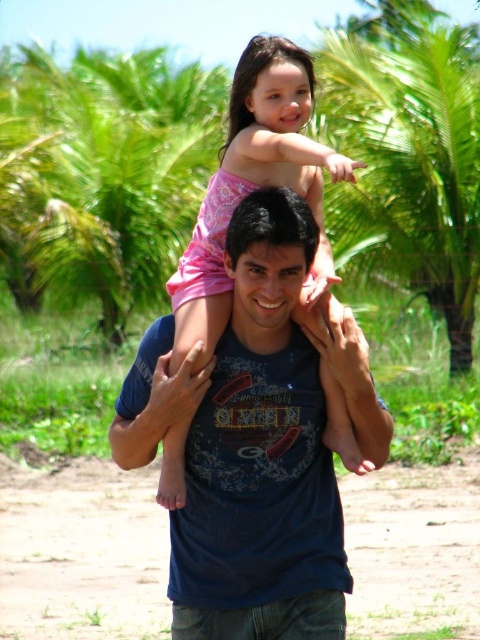
You are standing in the tropical location shown in the image. You want to take a photo of the palm tree represented by point (410, 152). Which direction should you face to capture it in your camera?

The green leafy palm tree at upper center is represented by point (410, 152). To capture it in your camera, you should face the upper center direction where the palm tree is located.

You are a photographer trying to capture a photo of the pink cotton shirt at center while also including the green leafy palm tree at upper center in the frame. Based on their sizes, will the palm tree appear larger than the shirt in the photo?

The green leafy palm tree at upper center is taller than the pink cotton shirt at center, so in the photo, the palm tree will appear larger than the shirt.